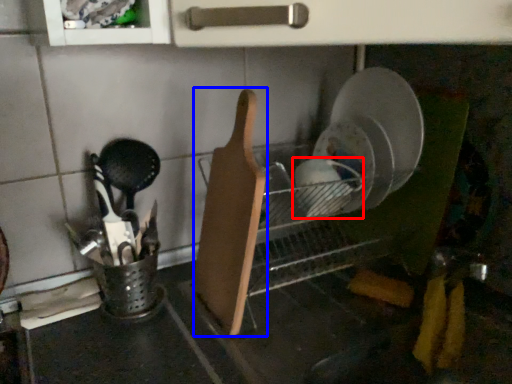
Question: Which of the following is the farthest to the observer, tableware (highlighted by a red box) or cutting board (highlighted by a blue box)?

Choices:
 (A) tableware
 (B) cutting board

Answer: (A)